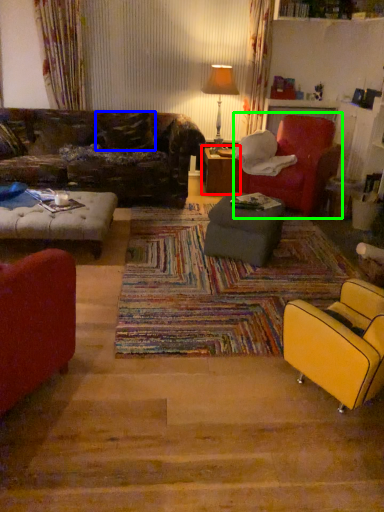
Question: Considering the real-world distances, which object is closest to table (highlighted by a red box)? pillow (highlighted by a blue box) or chair (highlighted by a green box).

Choices:
 (A) pillow
 (B) chair

Answer: (B)